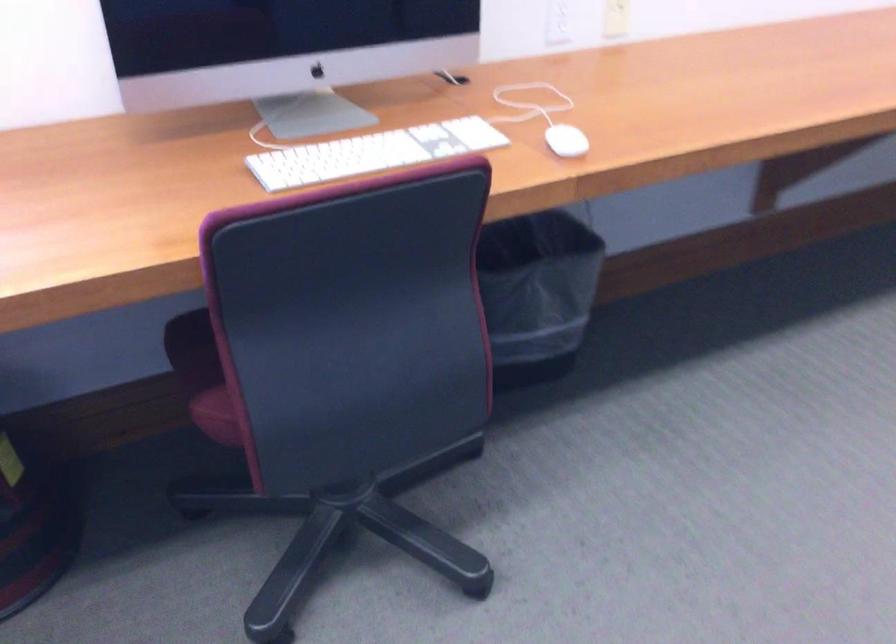
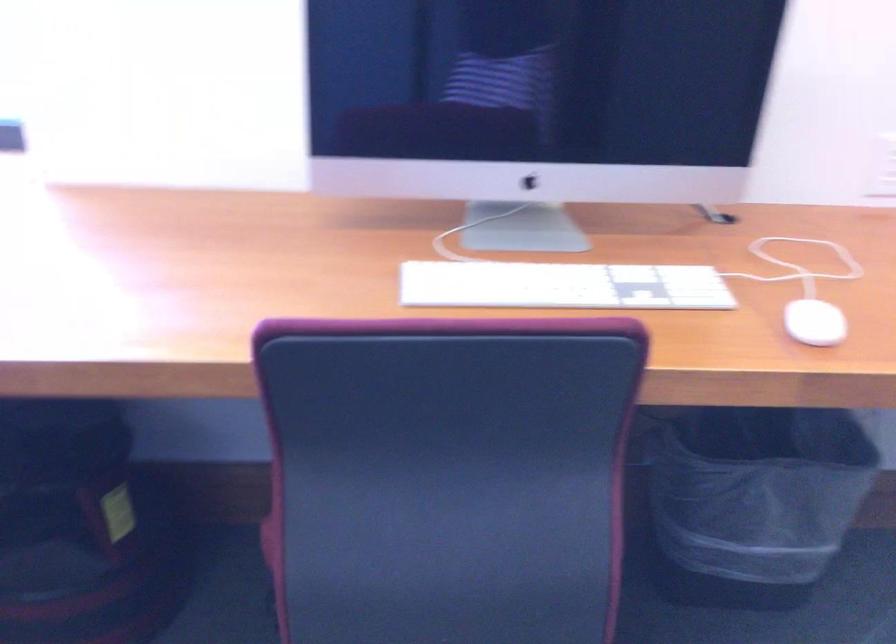
Which direction would the cameraman need to move to produce the second image?

The cameraman walked toward right, forward.